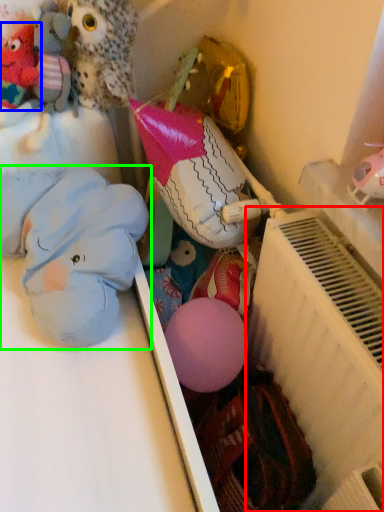
Question: Estimate the real-world distances between objects in this image. Which object is farther from radiator (highlighted by a red box), toy (highlighted by a blue box) or toy (highlighted by a green box)?

Choices:
 (A) toy
 (B) toy

Answer: (A)